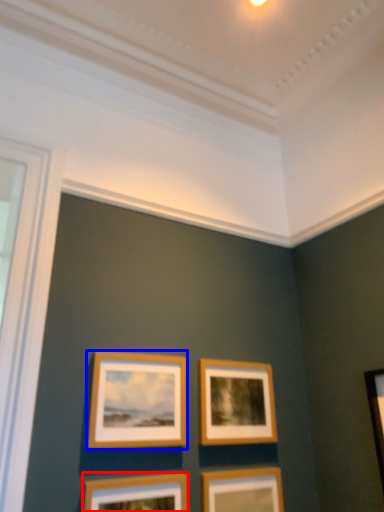
Question: Among these objects, which one is nearest to the camera, picture frame (highlighted by a red box) or picture frame (highlighted by a blue box)?

Choices:
 (A) picture frame
 (B) picture frame

Answer: (A)